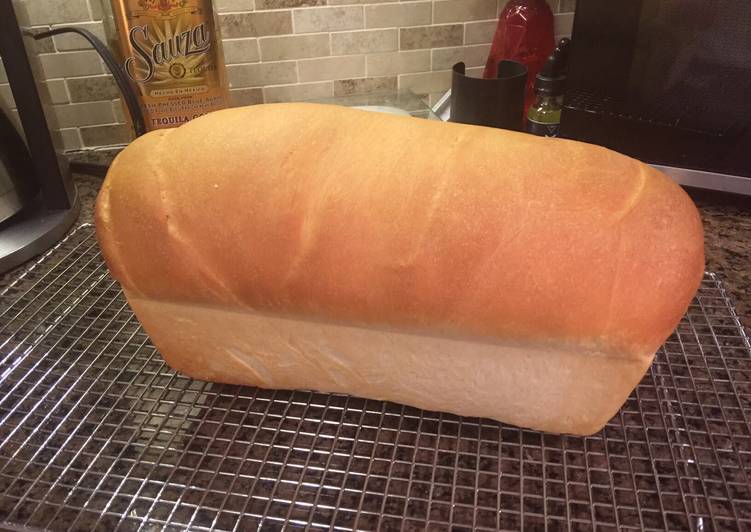
Identify the location of cord. (104, 55).